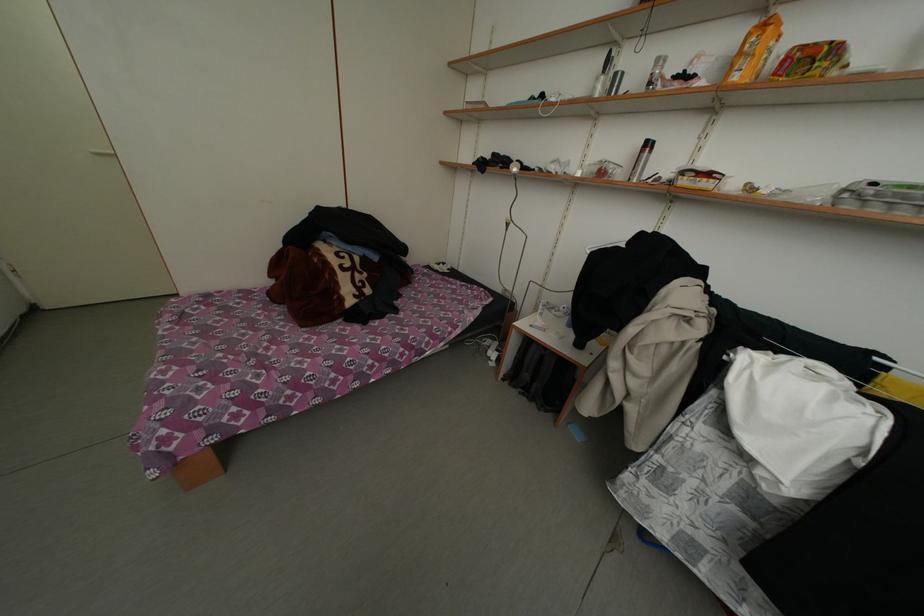
Which object does [881,197] point to?

This point indicates the clear egg carton.